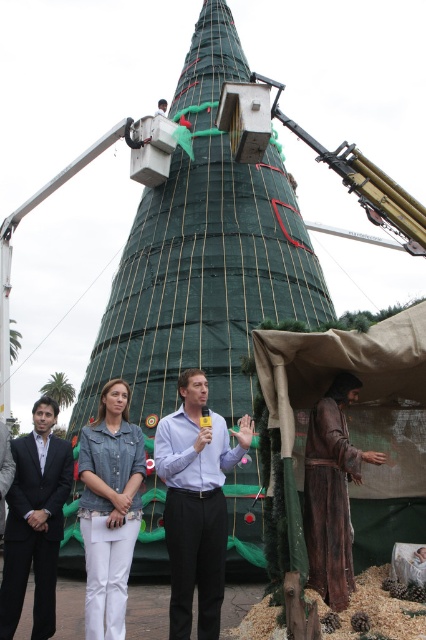
You are a delivery person who just arrived at the location and see the green netted christmas tree at center and the white plastic box at center. Which object is more to the right?

The green netted christmas tree at center is positioned on the right side of white plastic box at center, so it is more to the right.

You are standing in front of the Christmas tree and see the point at coordinates (195, 502). What object is located at that point?

The point at coordinates (195, 502) corresponds to the matte blue shirt at center.